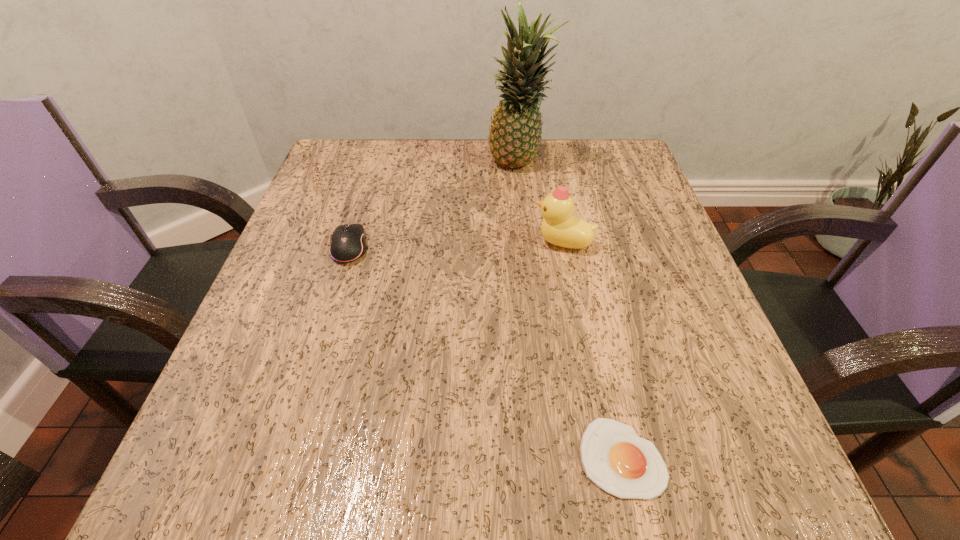
The image size is (960, 540). In order to click on the farthest object in this screenshot , I will do `click(515, 133)`.

At what (x,y) coordinates should I click in order to perform the action: click on the tallest object. Please return your answer as a coordinate pair (x, y). This screenshot has width=960, height=540. Looking at the image, I should click on (515, 133).

Where is `duckling`? This screenshot has width=960, height=540. duckling is located at coordinates [x=560, y=227].

Locate an element on the screen. The width and height of the screenshot is (960, 540). the leftmost object is located at coordinates (347, 243).

In order to click on the second shortest object in this screenshot , I will do `click(347, 243)`.

At what (x,y) coordinates should I click in order to perform the action: click on the shortest object. Please return your answer as a coordinate pair (x, y). This screenshot has height=540, width=960. Looking at the image, I should click on (623, 464).

The height and width of the screenshot is (540, 960). In order to click on the nearest object in this screenshot , I will do `click(623, 464)`.

The image size is (960, 540). In order to click on free space located 0.220m on the left of the pineapple in this screenshot , I will do `click(394, 165)`.

Locate an element on the screen. The width and height of the screenshot is (960, 540). vacant space located on the front-facing side of the duckling is located at coordinates (409, 242).

Where is `free space located 0.310m on the front-facing side of the duckling`? free space located 0.310m on the front-facing side of the duckling is located at coordinates (372, 242).